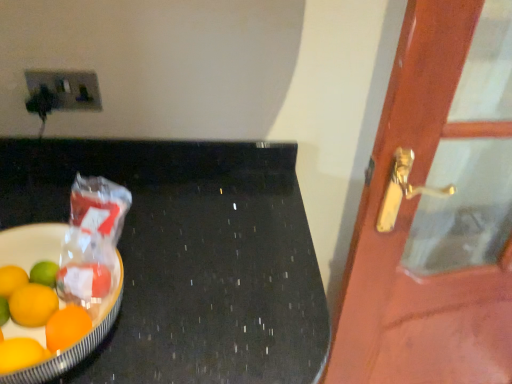
Locate an element on the screen. Image resolution: width=512 pixels, height=384 pixels. free spot above black polished table at left (from a real-world perspective) is located at coordinates (160, 233).